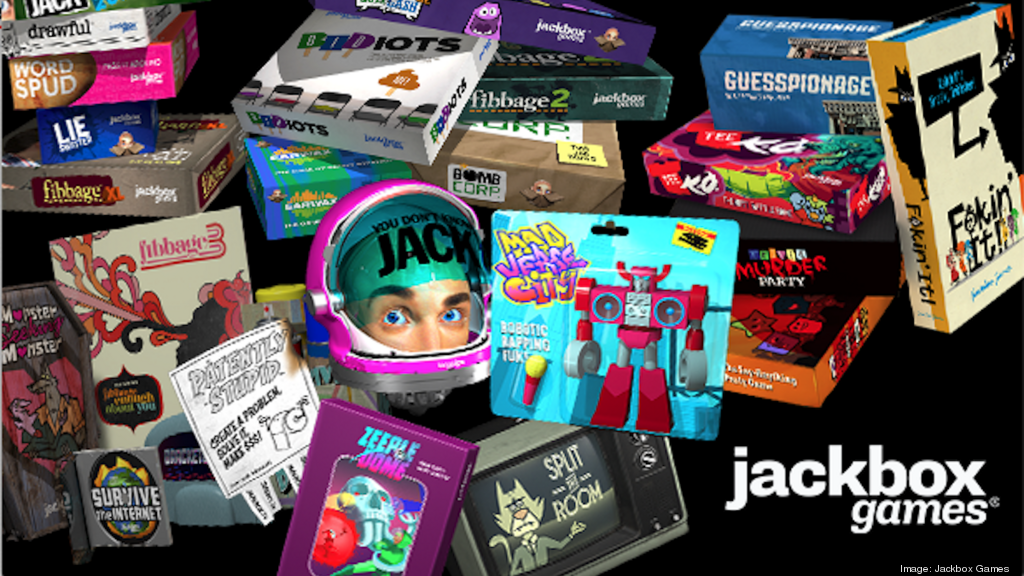
At what (x,y) coordinates should I click in order to perform the action: click on lower tv channel knob. Please return your answer as a coordinate pair (x, y). This screenshot has height=576, width=1024. Looking at the image, I should click on (649, 458).